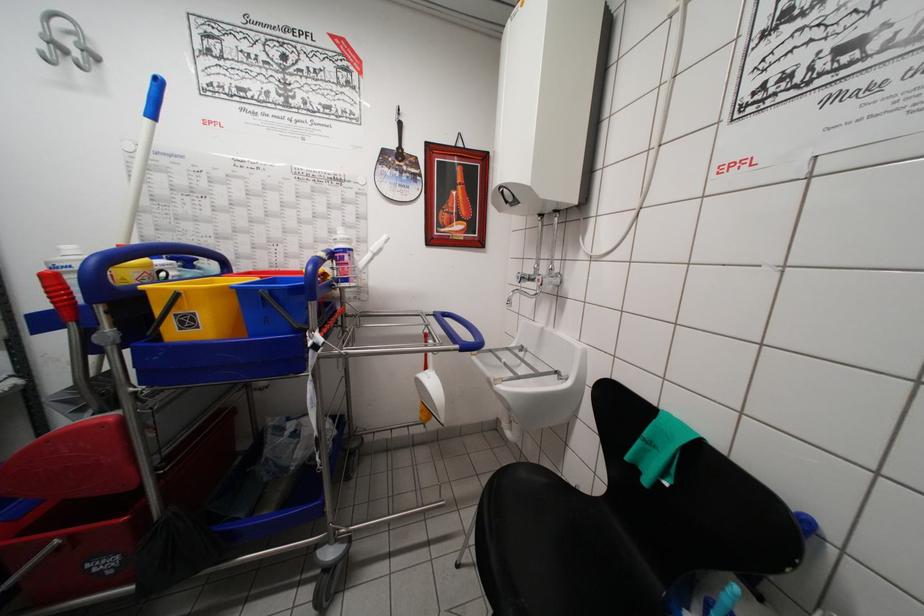
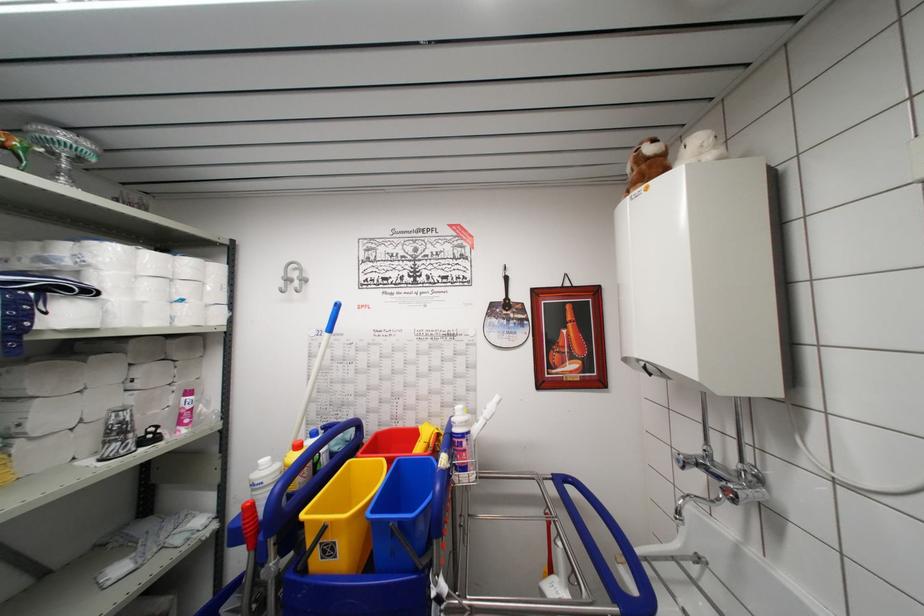
The point at (227, 276) is marked in the first image. Where is the corresponding point in the second image?

(361, 439)